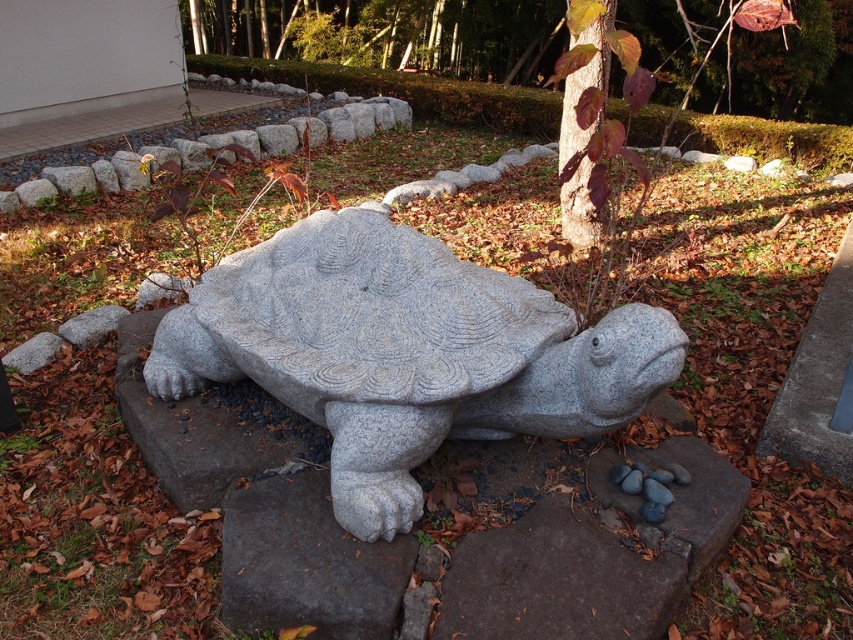
Question: Is granite tortoise at center thinner than green textured tree at upper center?

Choices:
 (A) no
 (B) yes

Answer: (B)

Question: Estimate the real-world distances between objects in this image. Which object is closer to the green textured tree at upper center?

Choices:
 (A) granite tortoise at center
 (B) smooth bark tree at center

Answer: (B)

Question: Among these points, which one is nearest to the camera?

Choices:
 (A) (308, 252)
 (B) (473, 35)

Answer: (A)

Question: Does granite tortoise at center have a smaller size compared to green textured tree at upper center?

Choices:
 (A) yes
 (B) no

Answer: (A)

Question: Which is nearer to the smooth bark tree at center?

Choices:
 (A) green textured tree at upper center
 (B) granite tortoise at center

Answer: (B)

Question: Can you confirm if green textured tree at upper center is positioned to the left of smooth bark tree at center?

Choices:
 (A) yes
 (B) no

Answer: (A)